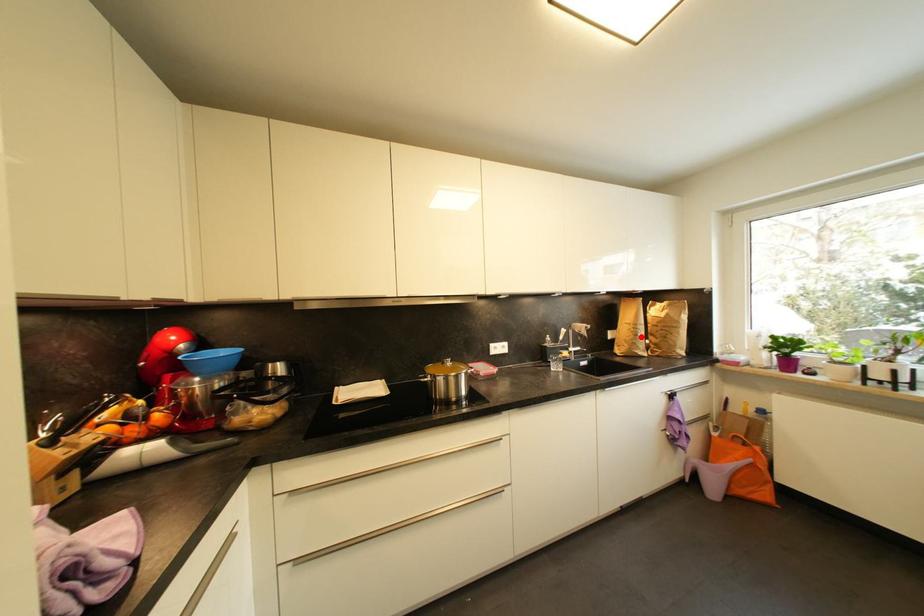
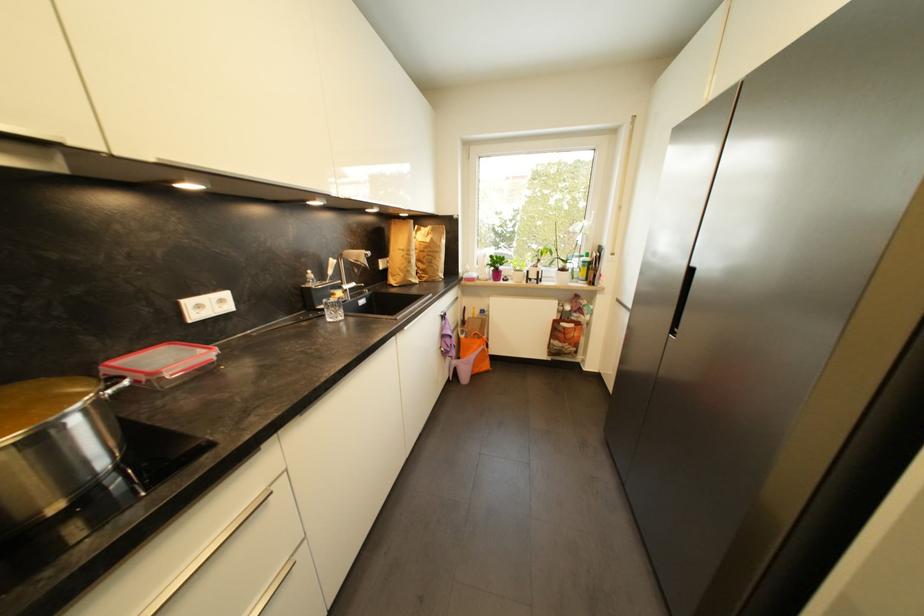
Find the pixel in the second image that matches the highlighted location in the first image.

(415, 264)